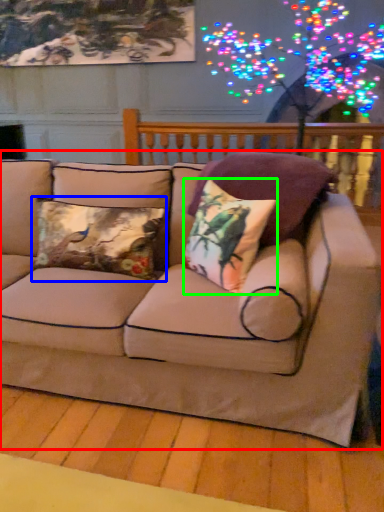
Question: Which is nearer to the studio couch (highlighted by a red box)? pillow (highlighted by a blue box) or pillow (highlighted by a green box).

Choices:
 (A) pillow
 (B) pillow

Answer: (B)